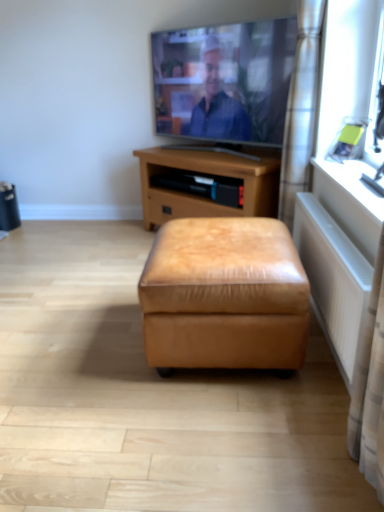
Question: Is brown leather ottoman at center placed right next to tan leather ottoman at center?

Choices:
 (A) yes
 (B) no

Answer: (B)

Question: From the image's perspective, is brown leather ottoman at center located above tan leather ottoman at center?

Choices:
 (A) no
 (B) yes

Answer: (B)

Question: Considering the relative positions of brown leather ottoman at center and tan leather ottoman at center in the image provided, is brown leather ottoman at center behind tan leather ottoman at center?

Choices:
 (A) no
 (B) yes

Answer: (B)

Question: From a real-world perspective, is brown leather ottoman at center positioned over tan leather ottoman at center based on gravity?

Choices:
 (A) yes
 (B) no

Answer: (A)

Question: Is brown leather ottoman at center bigger than tan leather ottoman at center?

Choices:
 (A) no
 (B) yes

Answer: (B)

Question: Is brown leather ottoman at center smaller than tan leather ottoman at center?

Choices:
 (A) yes
 (B) no

Answer: (B)

Question: Is tan leather ottoman at center shorter than brown leather ottoman at center?

Choices:
 (A) no
 (B) yes

Answer: (B)

Question: From the image's perspective, is tan leather ottoman at center under brown leather ottoman at center?

Choices:
 (A) no
 (B) yes

Answer: (B)

Question: Considering the relative positions of tan leather ottoman at center and brown leather ottoman at center in the image provided, is tan leather ottoman at center to the left of brown leather ottoman at center from the viewer's perspective?

Choices:
 (A) no
 (B) yes

Answer: (A)

Question: Is tan leather ottoman at center in front of brown leather ottoman at center?

Choices:
 (A) yes
 (B) no

Answer: (A)

Question: Can you see tan leather ottoman at center touching brown leather ottoman at center?

Choices:
 (A) yes
 (B) no

Answer: (B)

Question: Can you confirm if tan leather ottoman at center is bigger than brown leather ottoman at center?

Choices:
 (A) no
 (B) yes

Answer: (A)

Question: Considering the relative sizes of matte silver tv at upper center and brown leather ottoman at center in the image provided, is matte silver tv at upper center thinner than brown leather ottoman at center?

Choices:
 (A) yes
 (B) no

Answer: (A)